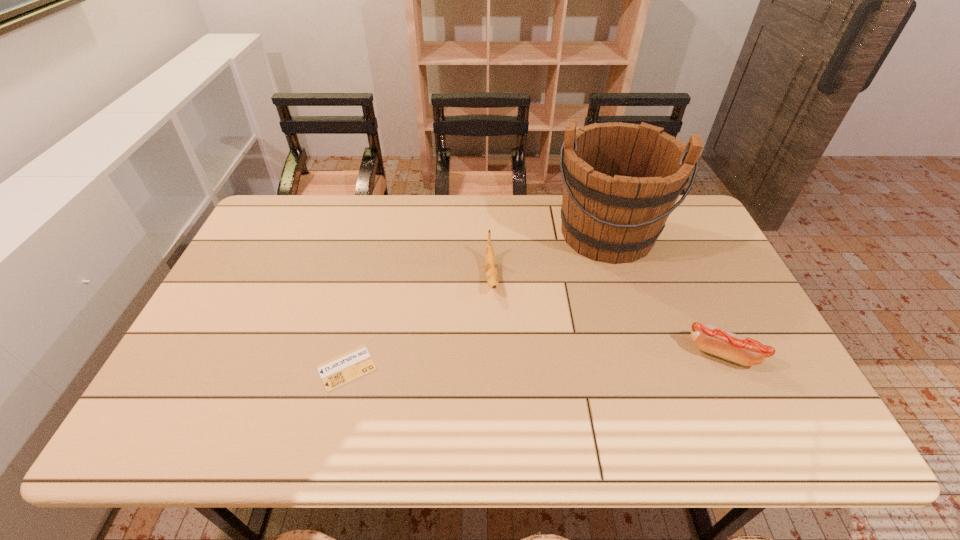
Where is `unoccupied position between the tallest object and the banana`? unoccupied position between the tallest object and the banana is located at coordinates (549, 255).

Find the location of a particular element. The width and height of the screenshot is (960, 540). free spot between the sausage and the banana is located at coordinates (607, 315).

This screenshot has width=960, height=540. What are the coordinates of `free area in between the leftmost object and the sausage` in the screenshot? It's located at (535, 360).

In order to click on vacant area between the tallest object and the sausage in this screenshot , I will do `click(664, 293)`.

Find the location of a particular element. This screenshot has height=540, width=960. unoccupied area between the shortest object and the tallest object is located at coordinates (476, 301).

Locate an element on the screen. The width and height of the screenshot is (960, 540). free spot between the identity card and the tallest object is located at coordinates (476, 301).

At what (x,y) coordinates should I click in order to perform the action: click on vacant space that's between the wine bucket and the leftmost object. Please return your answer as a coordinate pair (x, y). The image size is (960, 540). Looking at the image, I should click on (476, 301).

At what (x,y) coordinates should I click in order to perform the action: click on vacant point located between the wine bucket and the sausage. Please return your answer as a coordinate pair (x, y). This screenshot has width=960, height=540. Looking at the image, I should click on tap(664, 293).

Where is `object that stands as the closest to the sausage`? object that stands as the closest to the sausage is located at coordinates (621, 181).

Select which object appears as the closest to the third tallest object. Please provide its 2D coordinates. Your answer should be formatted as a tuple, i.e. [(x, y)], where the tuple contains the x and y coordinates of a point satisfying the conditions above.

[(621, 181)]